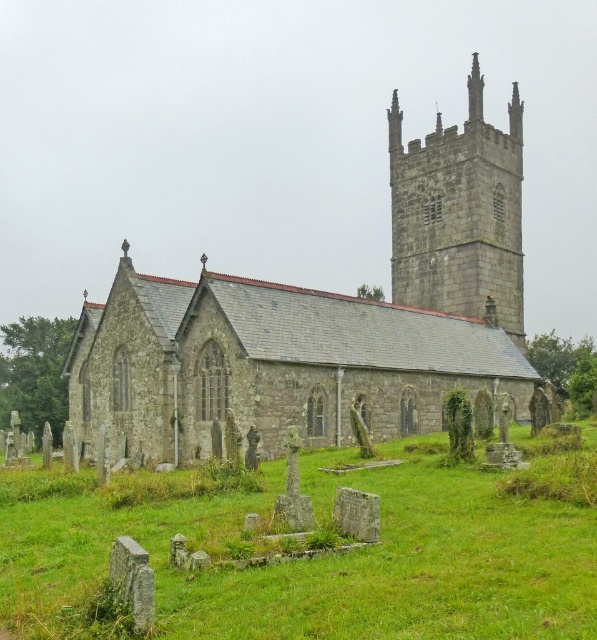
You are a photographer planning to capture the entire church and its surroundings in a single shot. You notice the green grass at center and the stone steeple at upper center. Which object should you focus on first to ensure both are in frame?

The green grass at center is wider than the stone steeple at upper center, so focusing on the green grass at center first will help ensure both objects are captured within the frame.

You are standing in front of the stone church at center and want to take a photo of the stone steeple at upper center. In which direction should you move to get the steeple into the frame?

You should move to the right to get the stone steeple at upper center into the frame since the stone church at center is to the left of the steeple.